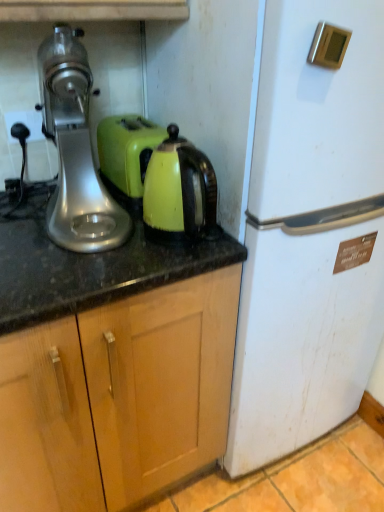
Question: Considering the relative positions of white matte refrigerator at right and silver metallic stand mixer at left in the image provided, is white matte refrigerator at right in front of silver metallic stand mixer at left?

Choices:
 (A) yes
 (B) no

Answer: (A)

Question: Is white matte refrigerator at right next to silver metallic stand mixer at left and touching it?

Choices:
 (A) yes
 (B) no

Answer: (B)

Question: Is silver metallic stand mixer at left completely or partially inside white matte refrigerator at right?

Choices:
 (A) no
 (B) yes

Answer: (A)

Question: Is white matte refrigerator at right thinner than silver metallic stand mixer at left?

Choices:
 (A) no
 (B) yes

Answer: (A)

Question: From the image's perspective, is white matte refrigerator at right on silver metallic stand mixer at left?

Choices:
 (A) yes
 (B) no

Answer: (B)

Question: Is white matte refrigerator at right oriented away from silver metallic stand mixer at left?

Choices:
 (A) yes
 (B) no

Answer: (B)

Question: Is silver metallic stand mixer at left positioned behind wooden cabinet at center?

Choices:
 (A) no
 (B) yes

Answer: (B)

Question: Is silver metallic stand mixer at left thinner than wooden cabinet at center?

Choices:
 (A) yes
 (B) no

Answer: (A)

Question: From the image's perspective, would you say silver metallic stand mixer at left is shown under wooden cabinet at center?

Choices:
 (A) no
 (B) yes

Answer: (A)

Question: Considering the relative sizes of silver metallic stand mixer at left and wooden cabinet at center in the image provided, is silver metallic stand mixer at left wider than wooden cabinet at center?

Choices:
 (A) yes
 (B) no

Answer: (B)

Question: Are silver metallic stand mixer at left and wooden cabinet at center beside each other?

Choices:
 (A) yes
 (B) no

Answer: (B)

Question: From the image's perspective, does silver metallic stand mixer at left appear higher than wooden cabinet at center?

Choices:
 (A) yes
 (B) no

Answer: (A)

Question: Is silver metallic stand mixer at left far from matte green kettle at center?

Choices:
 (A) no
 (B) yes

Answer: (A)